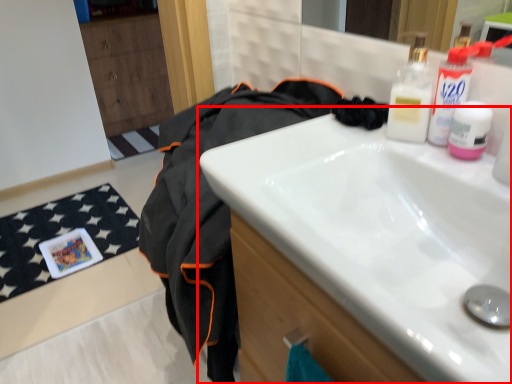
Question: From the image's perspective, where is sink (annotated by the red box) located in relation to clothing in the image?

Choices:
 (A) above
 (B) below

Answer: (A)